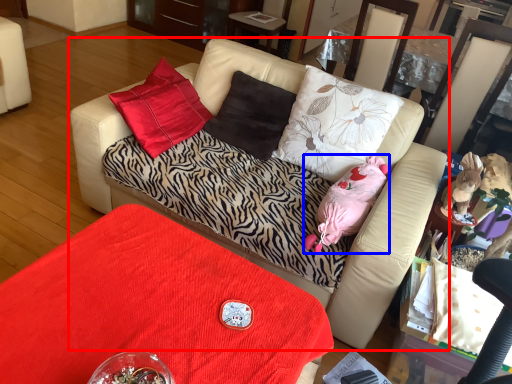
Question: Which object is closer to the camera taking this photo, studio couch (highlighted by a red box) or animal (highlighted by a blue box)?

Choices:
 (A) studio couch
 (B) animal

Answer: (A)